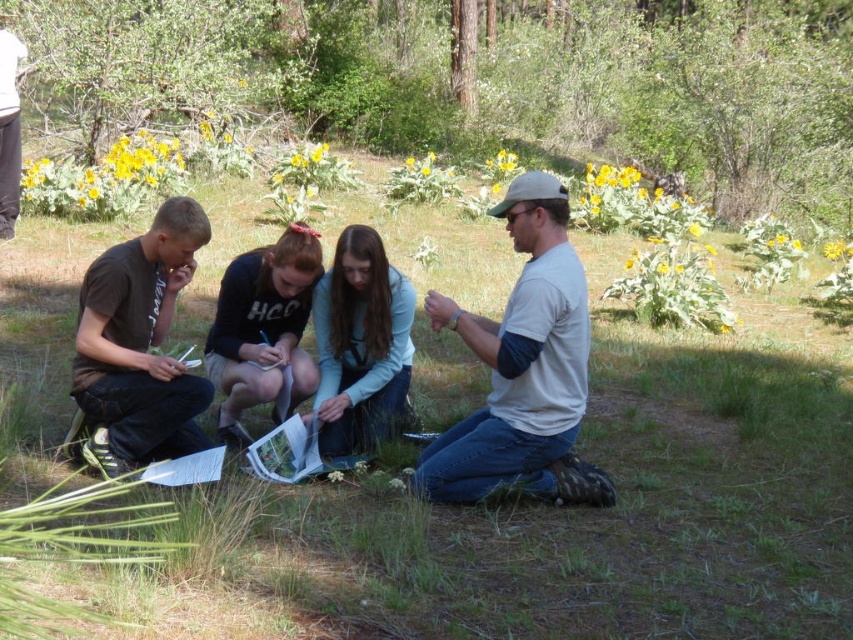
Between brown cotton shirt at left and brushed metal water at bottle left, which one appears on the left side from the viewer's perspective?

From the viewer's perspective, brushed metal water at bottle left appears more on the left side.

Can you confirm if brown cotton shirt at left is positioned above brushed metal water at bottle left?

No, brown cotton shirt at left is not above brushed metal water at bottle left.

Between point (134, 435) and point (0, 26), which one is positioned in front?

Point (134, 435)

At what (x,y) coordinates should I click in order to perform the action: click on brown cotton shirt at left. Please return your answer as a coordinate pair (x, y). This screenshot has width=853, height=640. Looking at the image, I should click on (138, 346).

Based on the photo, which of these two, green leafy tree at center or dark blue jeans at center, stands shorter?

With less height is dark blue jeans at center.

Is point (740, 168) behind point (299, 376)?

Yes.

This screenshot has width=853, height=640. I want to click on green leafy tree at center, so pos(479,81).

Can you confirm if dark blue jeans at center is bigger than brushed metal water at bottle left?

Indeed, dark blue jeans at center has a larger size compared to brushed metal water at bottle left.

Is dark blue jeans at center taller than brushed metal water at bottle left?

No, dark blue jeans at center is not taller than brushed metal water at bottle left.

Between point (283, 285) and point (10, 225), which one is positioned behind?

Positioned behind is point (10, 225).

The width and height of the screenshot is (853, 640). I want to click on dark blue jeans at center, so click(x=263, y=330).